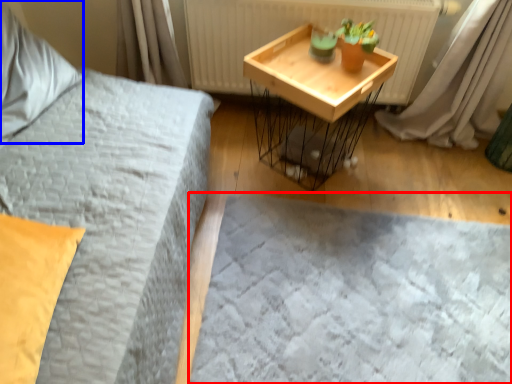
Question: Which object appears farthest to the camera in this image, bed frame (highlighted by a red box) or pillow (highlighted by a blue box)?

Choices:
 (A) bed frame
 (B) pillow

Answer: (A)